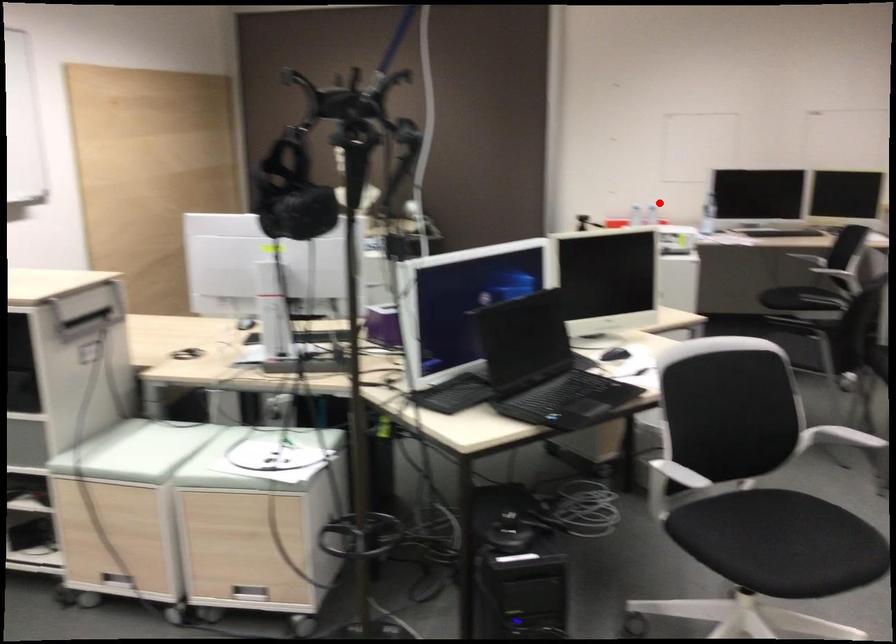
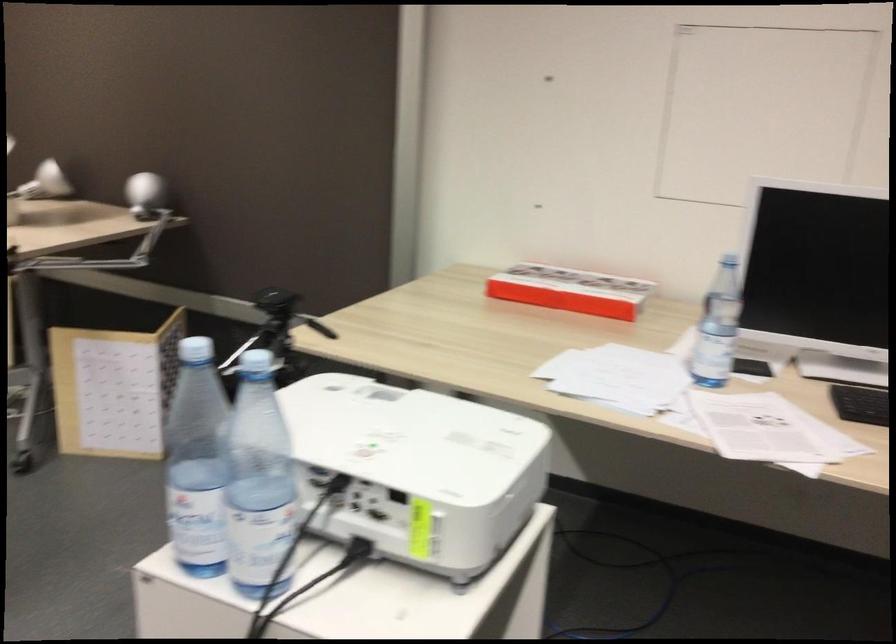
Question: I am providing you with two images of the same scene from different viewpoints. In image1, a red point is highlighted. Considering the same 3D point in image2, which of the following is correct?

Choices:
 (A) It is closer
 (B) It is farther

Answer: (A)